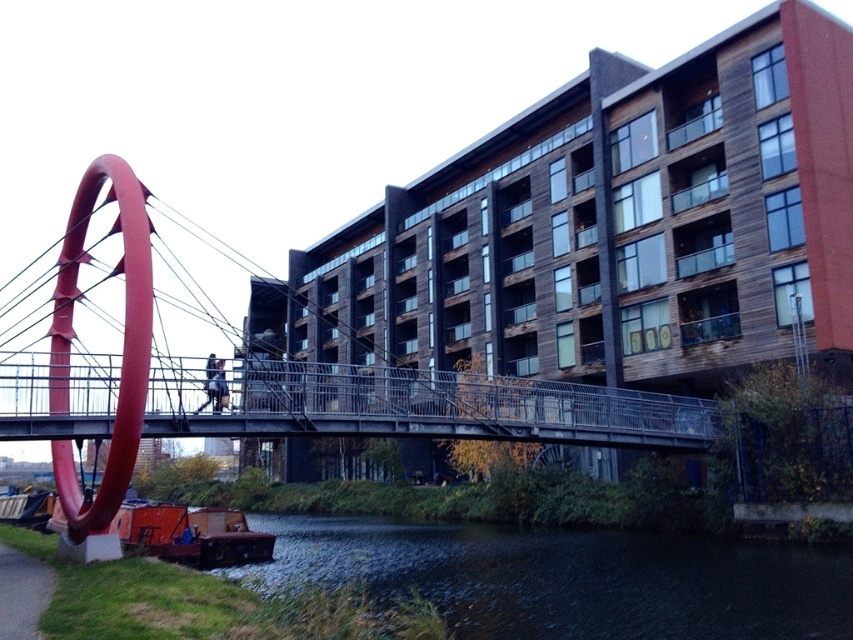
Who is more distant from viewer, [440,428] or [16,586]?

Positioned behind is point [440,428].

Who is positioned more to the right, metallic gray bridge at center or green grass at lower left?

metallic gray bridge at center is more to the right.

Locate an element on the screen. metallic gray bridge at center is located at coordinates (415, 404).

I want to click on metallic gray bridge at center, so click(415, 404).

Which is more to the right, dark water at lower left or metallic gray bridge at center?

Positioned to the right is dark water at lower left.

The image size is (853, 640). What do you see at coordinates (573, 579) in the screenshot?
I see `dark water at lower left` at bounding box center [573, 579].

What are the coordinates of `dark water at lower left` in the screenshot? It's located at (573, 579).

Does dark water at lower left appear under green grass at lower left?

Yes, dark water at lower left is below green grass at lower left.

Between dark water at lower left and green grass at lower left, which one has less height?

With less height is green grass at lower left.

Locate an element on the screen. The image size is (853, 640). dark water at lower left is located at coordinates (573, 579).

Find the location of a particular element. dark water at lower left is located at coordinates (573, 579).